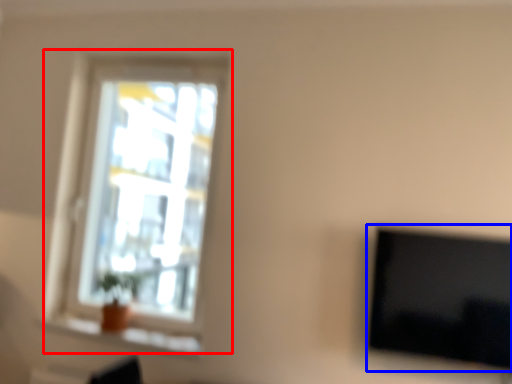
Question: Which object appears closest to the camera in this image, window (highlighted by a red box) or television (highlighted by a blue box)?

Choices:
 (A) window
 (B) television

Answer: (B)